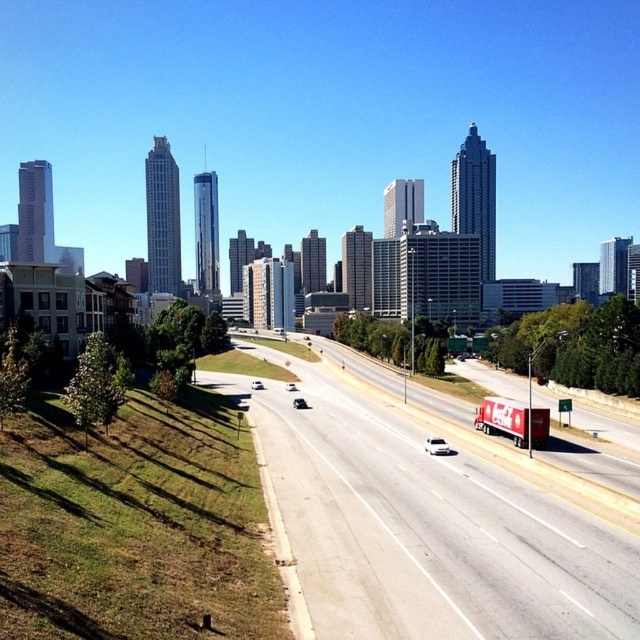
Is point (637, 560) more distant than point (428, 451)?

No, it is not.

Which is behind, point (502, 472) or point (436, 440)?

Positioned behind is point (436, 440).

Is point (593, 582) more distant than point (426, 449)?

No.

At what (x,y) coordinates should I click in order to perform the action: click on white asphalt highway at center. Please return your answer as a coordinate pair (x, y). This screenshot has width=640, height=640. Looking at the image, I should click on (428, 531).

Who is higher up, white glossy car at center or white matte car at center?

white matte car at center is above.

Is point (252, 381) less distant than point (289, 388)?

No, (252, 381) is behind (289, 388).

Who is more distant from viewer, (257,388) or (288,385)?

The point (288,385) is more distant.

At what (x,y) coordinates should I click in order to perform the action: click on white glossy car at center. Please return your answer as a coordinate pair (x, y). Looking at the image, I should click on (257, 385).

Who is more forward, (x=448, y=445) or (x=260, y=385)?

Point (x=448, y=445) is more forward.

Which of these two, white matte truck at center-right or white glossy car at center, stands shorter?

white matte truck at center-right

Identify the location of white matte truck at center-right. This screenshot has height=640, width=640. (436, 445).